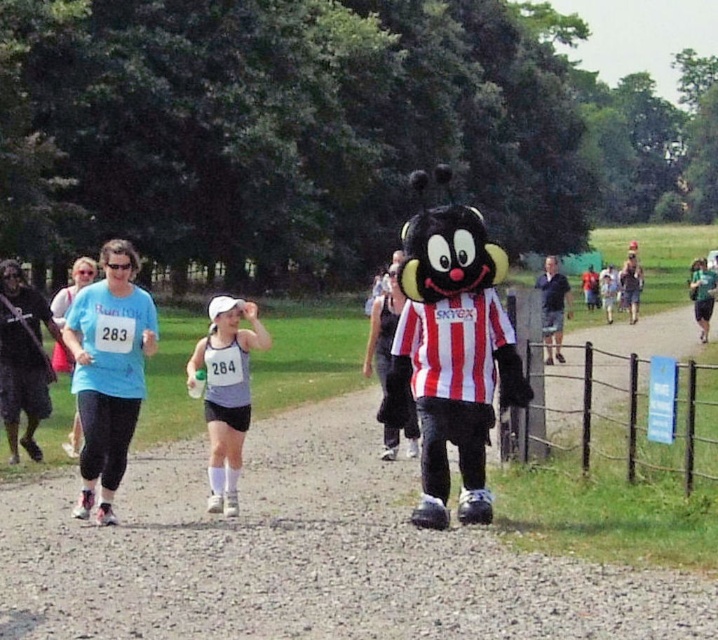
Question: Based on their relative distances, which object is nearer to the blue fabric shirt at right?

Choices:
 (A) gray fabric tank top at center
 (B) light blue t-shirt at center

Answer: (A)

Question: Estimate the real-world distances between objects in this image. Which object is closer to the light blue t-shirt at center?

Choices:
 (A) gray fabric tank top at center
 (B) blue fabric shirt at right

Answer: (A)

Question: Which of the following is the farthest from the observer?

Choices:
 (A) blue fabric shirt at right
 (B) light blue t-shirt at center

Answer: (A)

Question: Where is light blue t-shirt at center located in relation to gray fabric tank top at center in the image?

Choices:
 (A) below
 (B) above

Answer: (B)

Question: Is light blue t-shirt at center below blue fabric shirt at right?

Choices:
 (A) yes
 (B) no

Answer: (A)

Question: Does light blue t-shirt at center appear over blue fabric shirt at right?

Choices:
 (A) no
 (B) yes

Answer: (A)